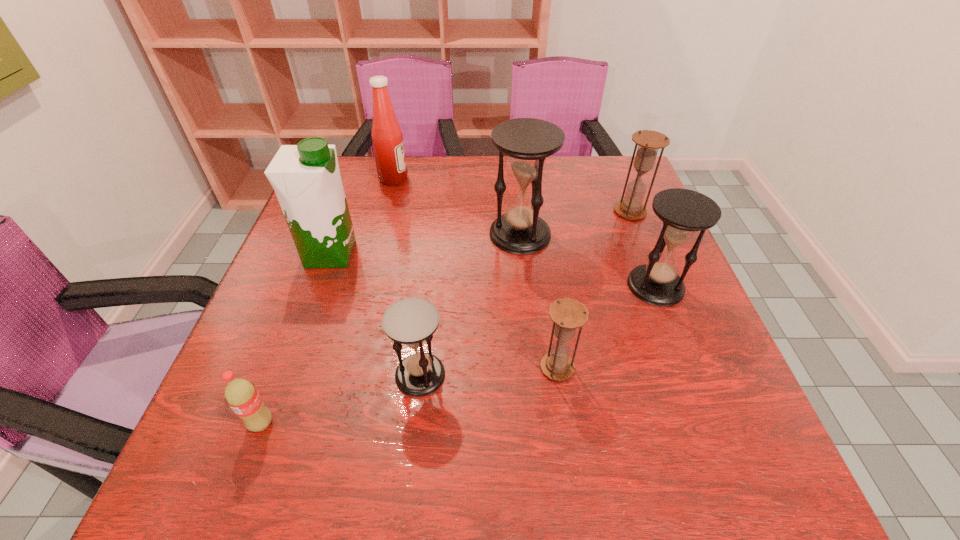
The width and height of the screenshot is (960, 540). In order to click on vacant space that satisfies the following two spatial constraints: 1. on the back side of the nearest object; 2. on the right side of the second black hourglass from left to right in this screenshot , I will do `click(332, 234)`.

Identify the location of vacant position in the image that satisfies the following two spatial constraints: 1. on the front side of the farthest black hourglass; 2. on the right side of the second farthest black hourglass. (525, 286).

This screenshot has width=960, height=540. I want to click on vacant area that satisfies the following two spatial constraints: 1. on the back side of the nearest black hourglass; 2. on the right side of the second smallest black hourglass, so click(x=430, y=286).

Where is `free space that satisfies the following two spatial constraints: 1. on the back side of the smallest black hourglass; 2. on the left side of the second biggest black hourglass`? The width and height of the screenshot is (960, 540). free space that satisfies the following two spatial constraints: 1. on the back side of the smallest black hourglass; 2. on the left side of the second biggest black hourglass is located at coordinates (430, 286).

Identify the location of vacant area that satisfies the following two spatial constraints: 1. on the front-facing side of the red condiment; 2. on the right side of the bigger brown hourglass. (386, 212).

Find the location of a particular element. Image resolution: width=960 pixels, height=540 pixels. free space that satisfies the following two spatial constraints: 1. on the front-facing side of the farthest object; 2. on the left side of the farther brown hourglass is located at coordinates (386, 212).